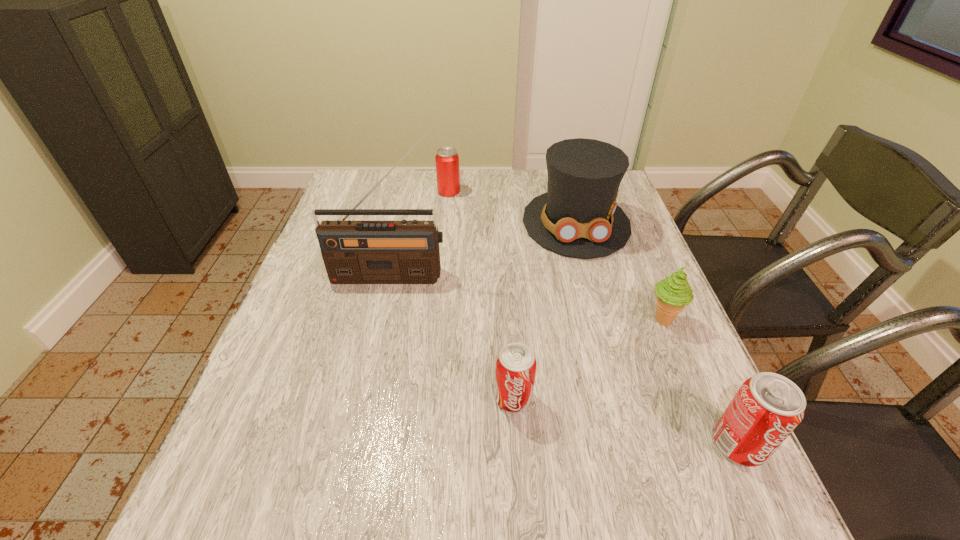
I want to click on vacant space located on the left of the nearest object, so click(x=663, y=444).

What are the coordinates of `vacant space situated with goggles on the front of the fifth shortest object` in the screenshot? It's located at (594, 289).

Identify the location of free point located 0.320m on the front of the can. (442, 262).

The height and width of the screenshot is (540, 960). Identify the location of free space located on the front-facing side of the fourth nearest object. (381, 321).

Locate an element on the screen. The height and width of the screenshot is (540, 960). vacant space positioned 0.330m on the back of the icecream is located at coordinates (624, 226).

The image size is (960, 540). I want to click on dress hat at the far edge, so click(578, 216).

This screenshot has width=960, height=540. Find the location of `can that is at the far edge`. can that is at the far edge is located at coordinates (447, 159).

Identify the location of object present at the near edge. point(766,409).

The image size is (960, 540). Find the location of `object at the left edge`. object at the left edge is located at coordinates (354, 252).

I want to click on soda can positioned at the right edge, so pos(766,409).